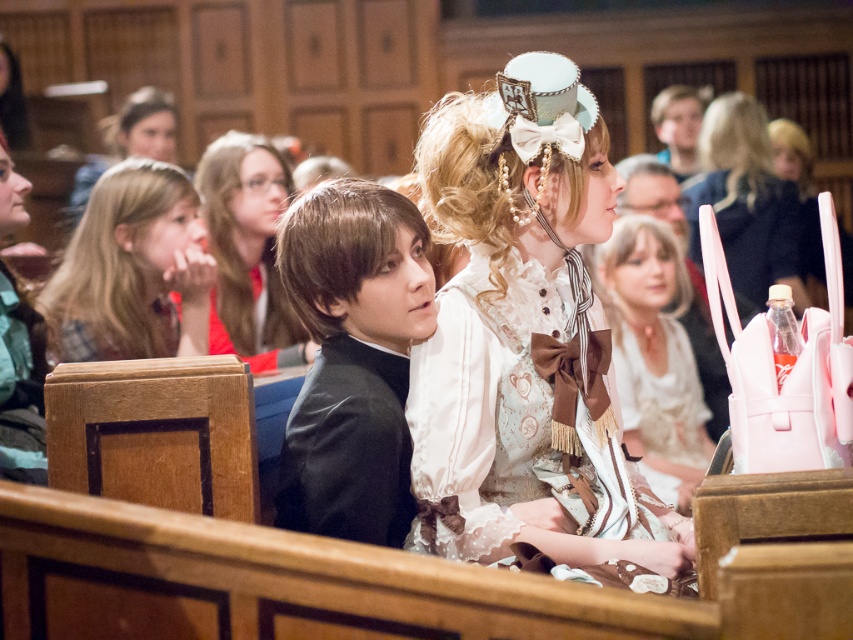
Question: Among these points, which one is nearest to the camera?

Choices:
 (A) (697, 193)
 (B) (619, 349)
 (C) (256, 364)
 (D) (178, 189)

Answer: (D)

Question: Can you confirm if white lace dress at center is smaller than matte white dress at center?

Choices:
 (A) yes
 (B) no

Answer: (A)

Question: Which of the following is the closest to the observer?

Choices:
 (A) white lace dress at center
 (B) matte white purse at upper right

Answer: (A)

Question: Considering the relative positions of blonde hair at center and matte black dress at center in the image provided, where is blonde hair at center located with respect to matte black dress at center?

Choices:
 (A) left
 (B) right

Answer: (A)

Question: Is white lace dress at center thinner than black satin suit at center?

Choices:
 (A) no
 (B) yes

Answer: (A)

Question: Which of the following is the closest to the observer?

Choices:
 (A) black satin suit at center
 (B) white lace dress at center
 (C) matte black hairband at upper left

Answer: (B)